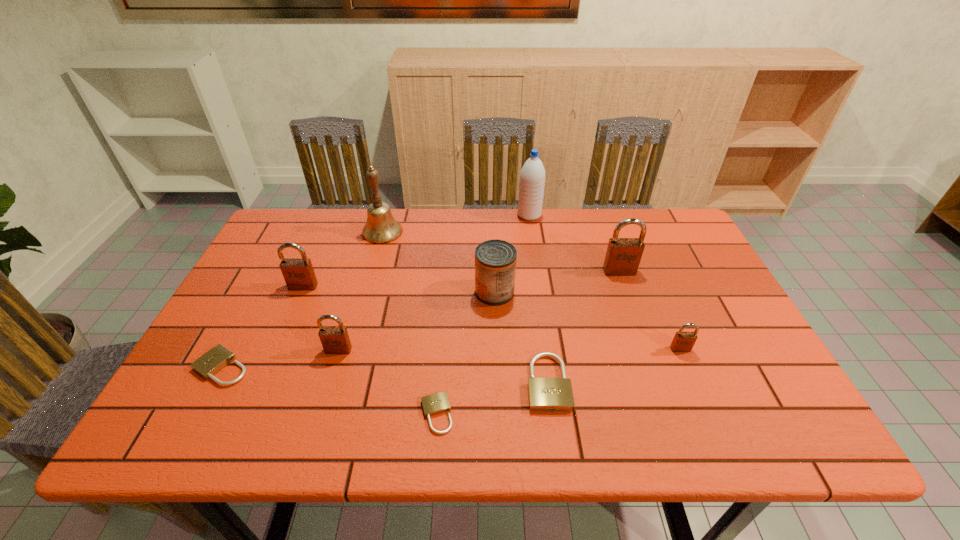
This screenshot has width=960, height=540. Identify the location of object located at the right edge. (683, 341).

The height and width of the screenshot is (540, 960). Identify the location of vacant space at the far edge. point(446,222).

The height and width of the screenshot is (540, 960). In order to click on vacant region at the near edge of the desktop in this screenshot , I will do `click(525, 441)`.

Where is `blank space at the left edge`? The image size is (960, 540). blank space at the left edge is located at coordinates (208, 346).

Identify the location of empty space that is in between the tallest padlock and the sixth tallest object. (479, 310).

I want to click on vacant area that lies between the fifth object from right to left and the fourth padlock from left to right, so click(x=466, y=353).

At what (x,y) coordinates should I click in order to perform the action: click on free space that is in between the third tallest padlock and the fourth shortest object. Please return your answer as a coordinate pair (x, y). The image size is (960, 540). Looking at the image, I should click on click(510, 349).

Locate an element on the screen. free space between the fifth object from left to right and the third biggest brown padlock is located at coordinates (388, 382).

The height and width of the screenshot is (540, 960). In order to click on free area in between the leftmost beige padlock and the bell in this screenshot , I will do `click(302, 299)`.

Identify the location of free space between the second brown padlock from right to left and the third tallest padlock. click(x=479, y=310).